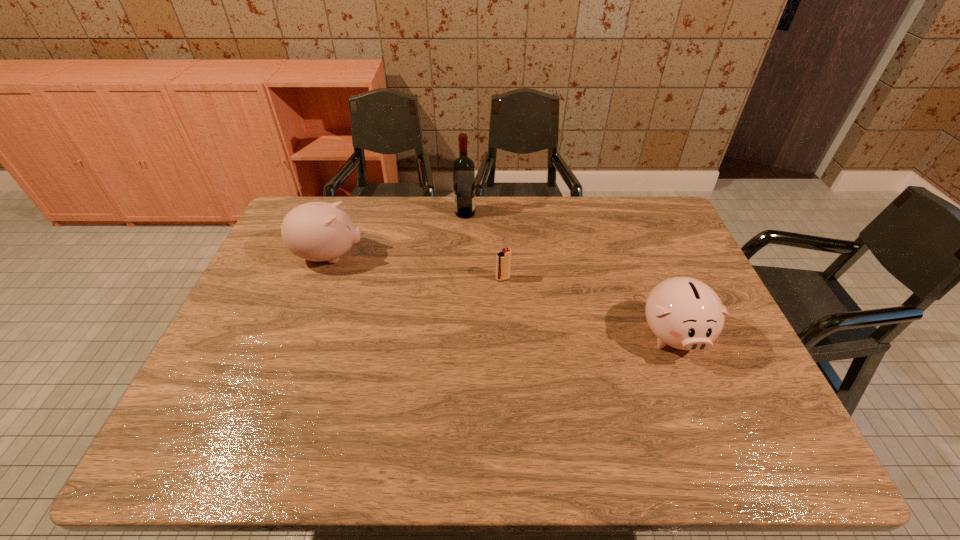
Where is `vacant space at the far right corner`? This screenshot has height=540, width=960. vacant space at the far right corner is located at coordinates (635, 221).

Where is `free point between the second object from right to left and the nearer piggy bank`? This screenshot has height=540, width=960. free point between the second object from right to left and the nearer piggy bank is located at coordinates [588, 306].

At what (x,y) coordinates should I click in order to perform the action: click on unoccupied position between the igniter and the rightmost object. Please return your answer as a coordinate pair (x, y). Looking at the image, I should click on (588, 306).

You are a GUI agent. You are given a task and a screenshot of the screen. Output one action in this format:
    pyautogui.click(x=<x>, y=<y>)
    Task: Click on the free spot between the shortest object and the rightmost object
    This screenshot has width=960, height=540.
    Given the screenshot: What is the action you would take?
    pyautogui.click(x=588, y=306)

You are a GUI agent. You are given a task and a screenshot of the screen. Output one action in this format:
    pyautogui.click(x=<x>, y=<y>)
    Task: Click on the free point between the left piggy bank and the right piggy bank
    
    Given the screenshot: What is the action you would take?
    pyautogui.click(x=501, y=295)

Where is `free space between the farthest object and the farther piggy bank`? The image size is (960, 540). free space between the farthest object and the farther piggy bank is located at coordinates click(x=397, y=234).

Find the location of a particular element. vacant area that lies between the nearer piggy bank and the leftmost object is located at coordinates (501, 295).

Identify the location of vacant region between the leftmost object and the nearest object. (501, 295).

Locate an element on the screen. free spot between the right piggy bank and the left piggy bank is located at coordinates (501, 295).

Find the location of a particular element. The height and width of the screenshot is (540, 960). free space that is in between the second object from left to right and the nearer piggy bank is located at coordinates (568, 273).